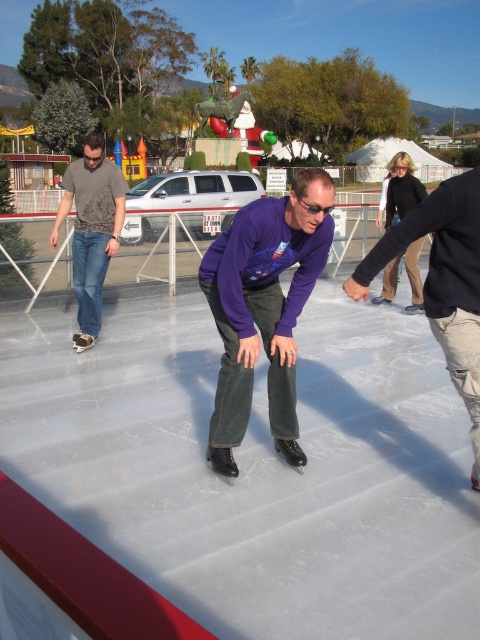
You are an ice skater standing at the edge of the rink. You see the matte black ice at center and the dark gray jeans at center. How far apart are these two objects?

The matte black ice at center is 4.35 feet from the dark gray jeans at center.

You are an ice skater who wants to avoid stepping on the purple matte shirt at center. Can you safely skate around it on the matte black ice at center?

The matte black ice at center might be wider than purple matte shirt at center, so there might be enough space to skate around it safely.